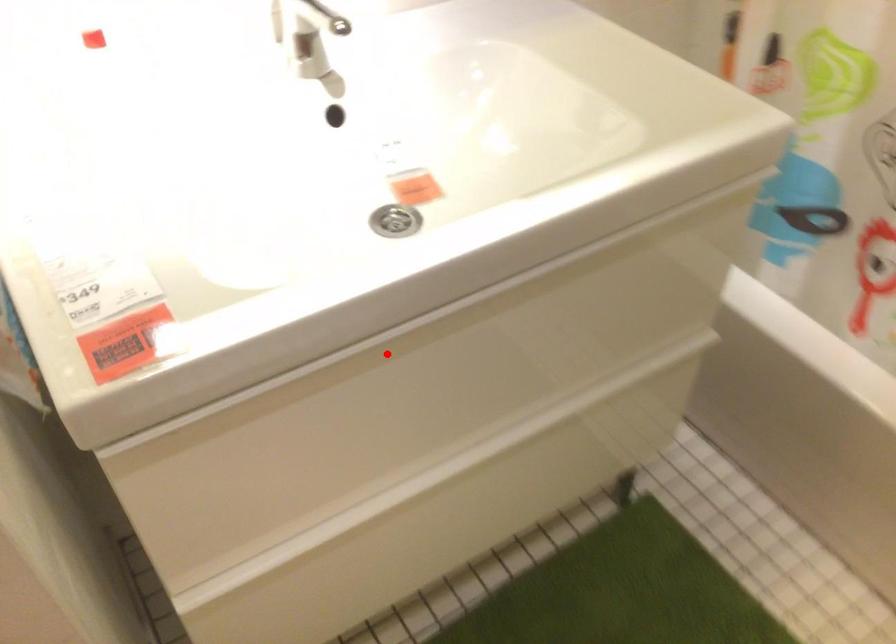
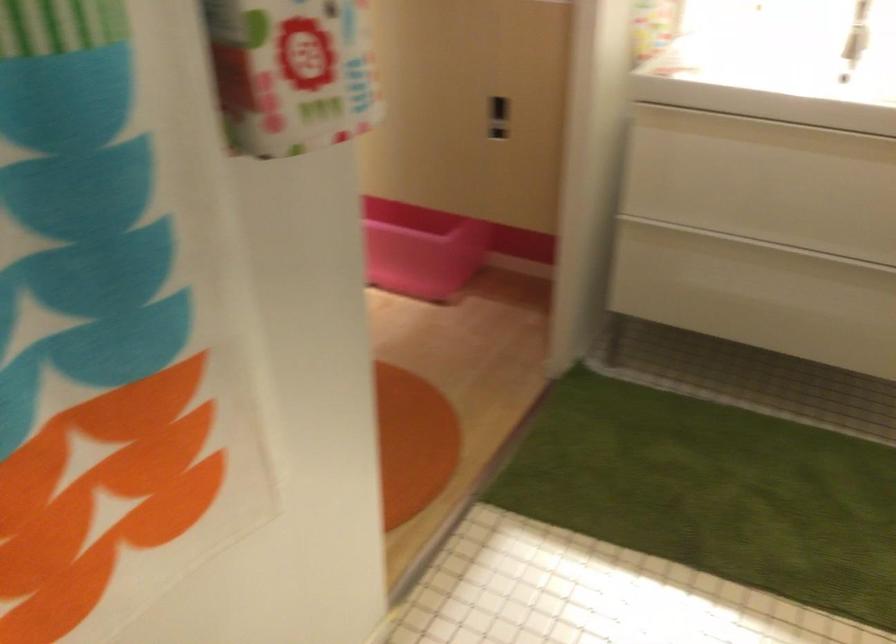
Where in the second image is the point corresponding to the highlighted location from the first image?

(764, 131)